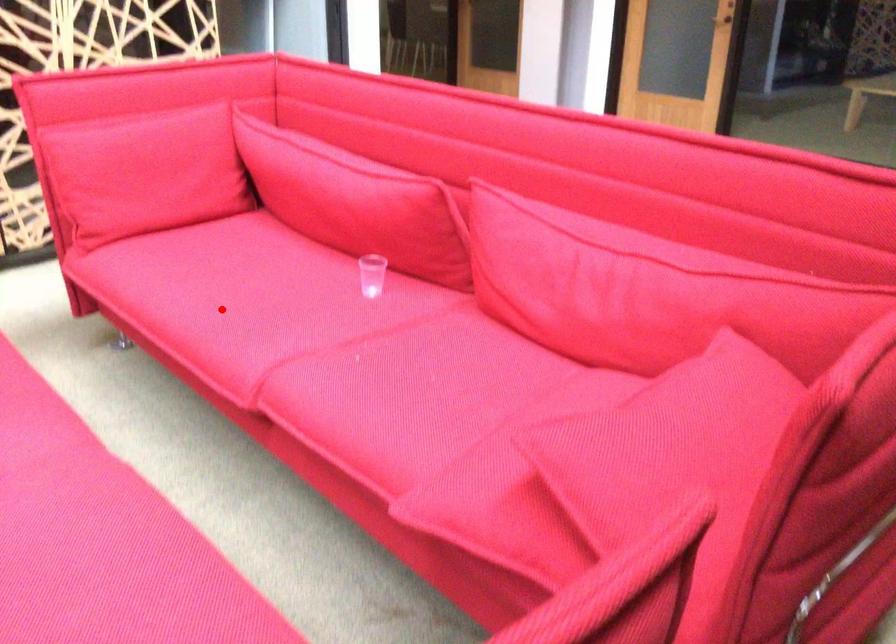
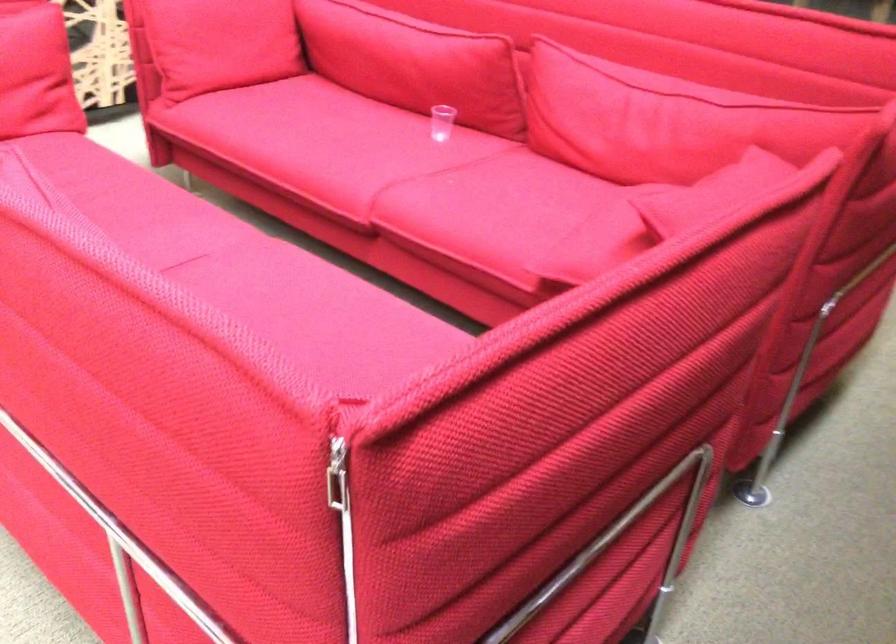
The point at the highlighted location is marked in the first image. Where is the corresponding point in the second image?

(320, 146)